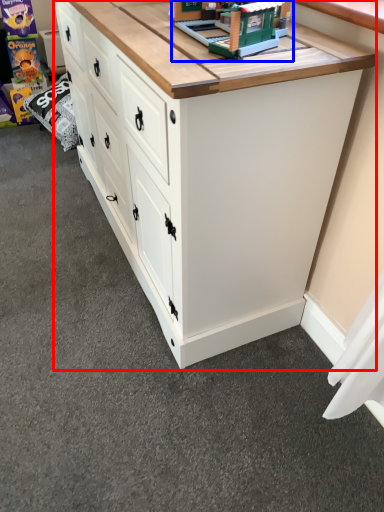
Question: Which point is closer to the camera, chest of drawers (highlighted by a red box) or toy (highlighted by a blue box)?

Choices:
 (A) chest of drawers
 (B) toy

Answer: (A)